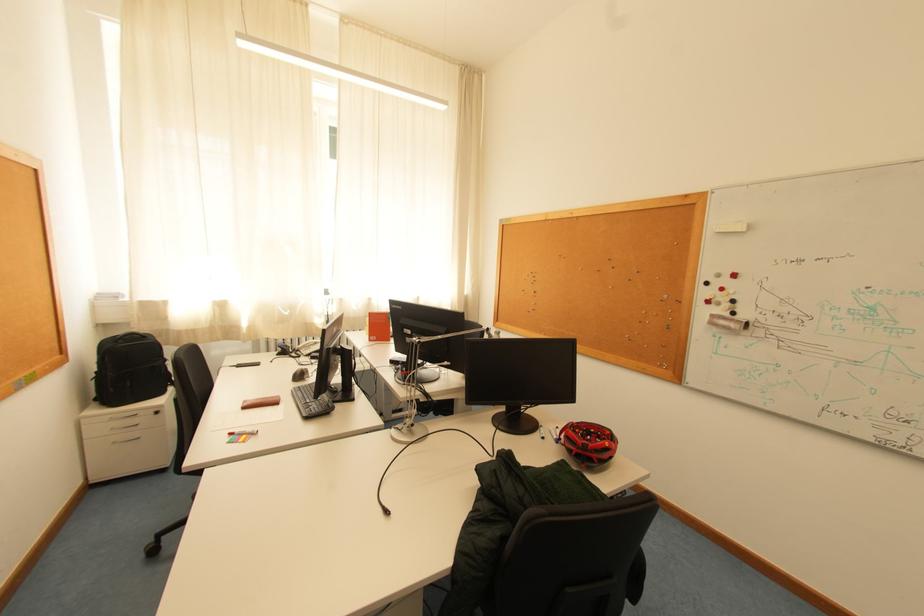
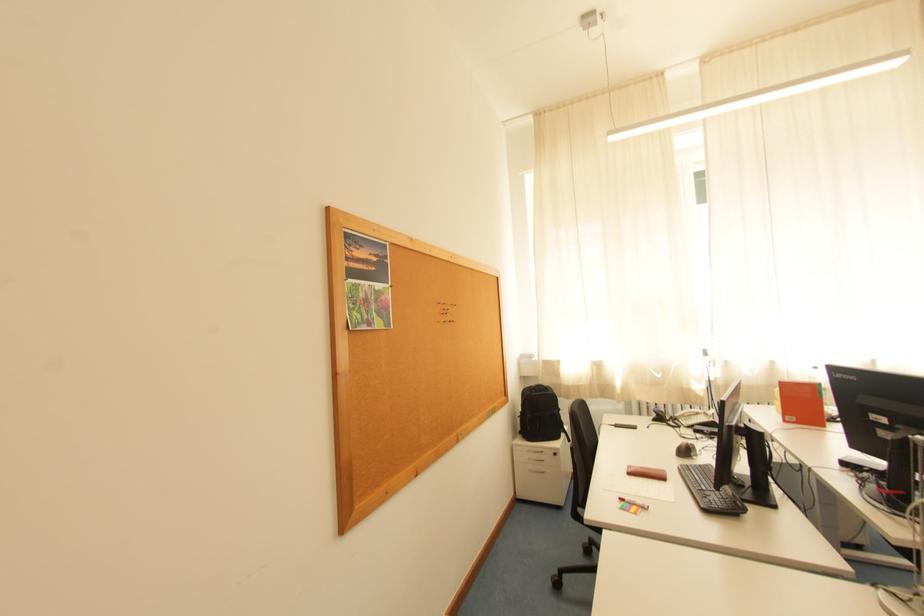
Find the pixel in the second image that matches (103,400) in the first image.

(528, 434)